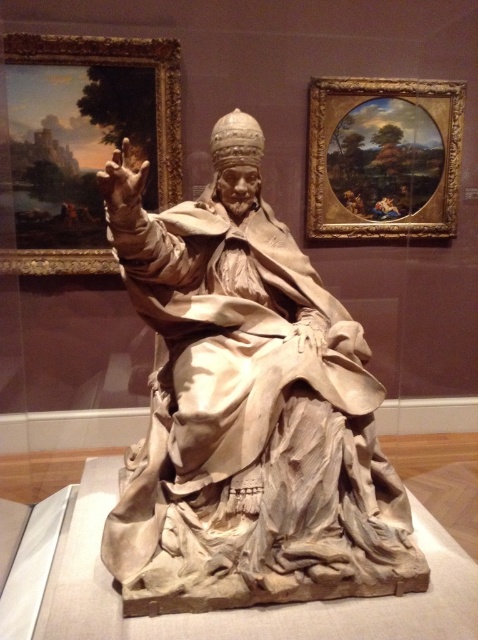
Question: Can you confirm if white marble statue at center is smaller than olive green oil painting at upper right?

Choices:
 (A) no
 (B) yes

Answer: (A)

Question: Which of the following is the farthest from the observer?

Choices:
 (A) white marble statue at center
 (B) olive green oil painting at upper right

Answer: (B)

Question: Is white marble statue at center closer to camera compared to olive green oil painting at upper right?

Choices:
 (A) yes
 (B) no

Answer: (A)

Question: From the image, what is the correct spatial relationship of white marble statue at center in relation to olive green oil painting at upper right?

Choices:
 (A) right
 (B) left

Answer: (B)

Question: Which point appears farthest from the camera in this image?

Choices:
 (A) (455, 86)
 (B) (301, 449)

Answer: (A)